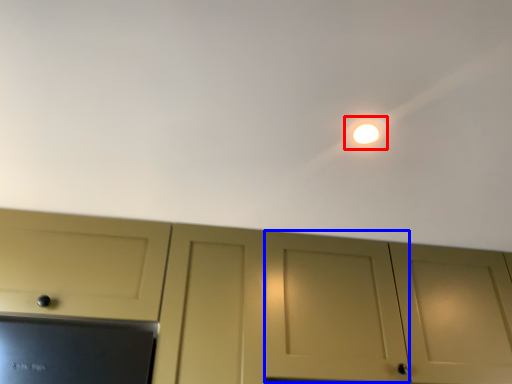
Question: Which object appears closest to the camera in this image, light (highlighted by a red box) or door (highlighted by a blue box)?

Choices:
 (A) light
 (B) door

Answer: (A)